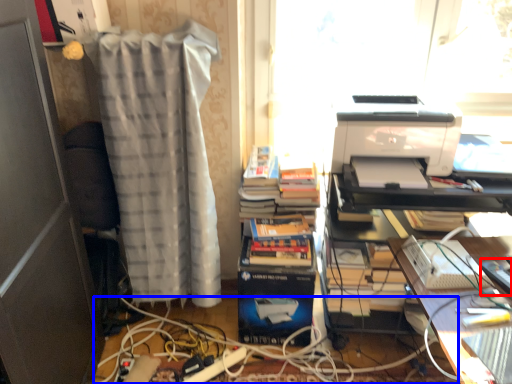
Question: Among these objects, which one is farthest to the camera, equipment (highlighted by a red box) or cable (highlighted by a blue box)?

Choices:
 (A) equipment
 (B) cable

Answer: (B)